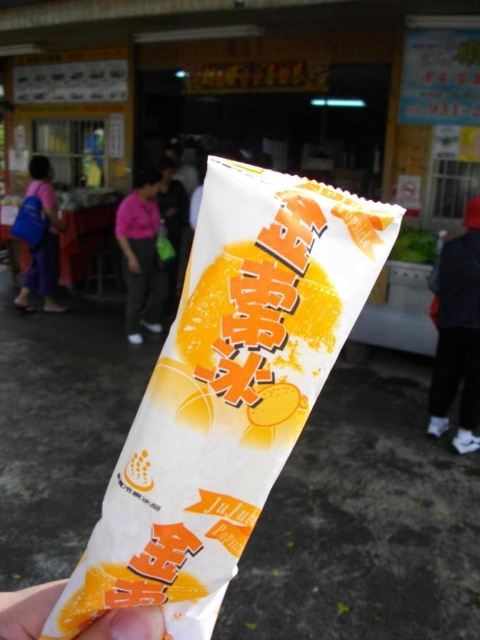
Question: Which object is positioned farthest from the matte purple pants at lower left?

Choices:
 (A) dark blue jeans at lower right
 (B) pink fabric shirt at center
 (C) white paper at center

Answer: (C)

Question: From the image, what is the correct spatial relationship of dark blue jeans at lower right in relation to pink fabric shirt at center?

Choices:
 (A) right
 (B) left

Answer: (A)

Question: Does dark blue jeans at lower right lie behind white paper at center?

Choices:
 (A) no
 (B) yes

Answer: (B)

Question: Is pink fabric shirt at center positioned in front of white paper at center?

Choices:
 (A) no
 (B) yes

Answer: (A)

Question: Which object is the closest to the matte purple pants at lower left?

Choices:
 (A) pink fabric shirt at center
 (B) white paper at center

Answer: (A)

Question: Which point is closer to the camera?

Choices:
 (A) white paper at center
 (B) pink fabric shirt at center
 (C) matte purple pants at lower left

Answer: (A)